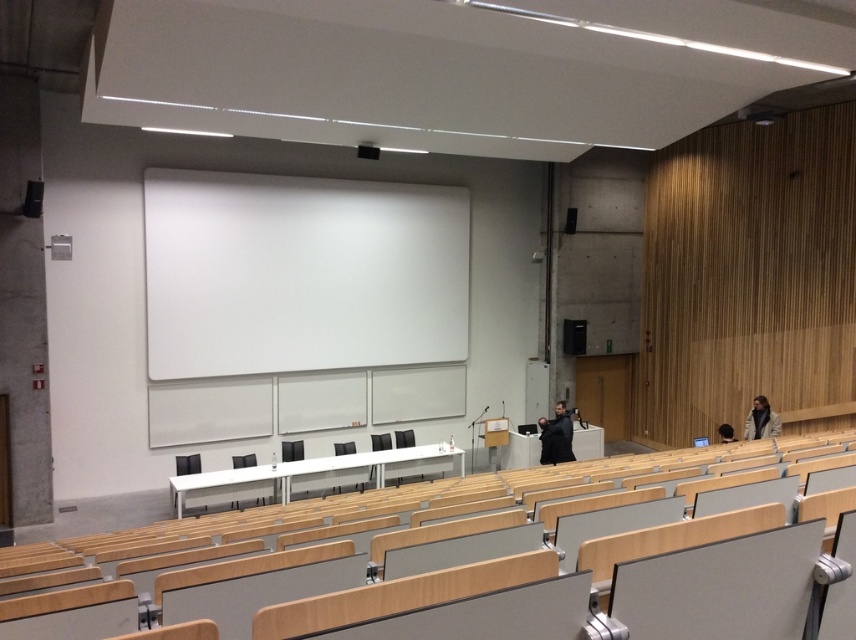
You are an event organizer setting up a presentation. You need to place a new speaker system. The current black matte speaker at upper left is blocking the projection area. Can you move it to the side without moving the white matte projection screen at center?

The black matte speaker at upper left is behind the white matte projection screen at center, so moving it to the side would require adjusting its position in front of the screen. Since it is currently behind, moving it to the side while keeping it in front of the screen would be possible without moving the screen itself.

You are an event organizer setting up a presentation in the lecture hall. You need to place a new speaker at the exact location of the point marked at coordinates point (33, 198). Where should you place the speaker in the room?

The black matte speaker at upper left is located at point (33, 198), so you should place the new speaker at the same position as the black matte speaker at upper left.

You are a technician setting up audio equipment in the lecture hall. You need to position the black plastic speaker at right and the black matte speaker at upper left so that the sound reaches the entire room. Considering their placement, which speaker is positioned closer to the audience seating area?

The black plastic speaker at right is closer to the audience seating area because the black matte speaker at upper left is behind it.